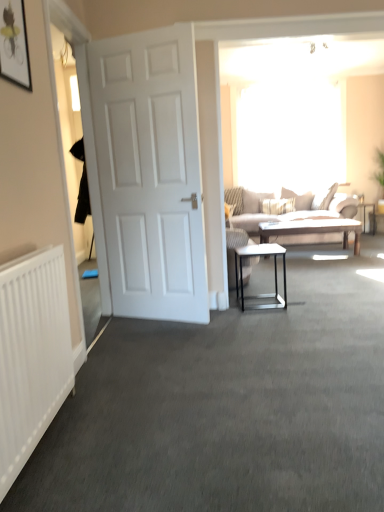
Question: Can you confirm if white matte door at left is taller than metallic silver side table at right?

Choices:
 (A) yes
 (B) no

Answer: (A)

Question: Is white matte door at left placed right next to metallic silver side table at right?

Choices:
 (A) no
 (B) yes

Answer: (A)

Question: Does white matte door at left appear on the left side of metallic silver side table at right?

Choices:
 (A) yes
 (B) no

Answer: (A)

Question: Can you confirm if white matte door at left is smaller than metallic silver side table at right?

Choices:
 (A) no
 (B) yes

Answer: (A)

Question: Can you confirm if white matte door at left is shorter than metallic silver side table at right?

Choices:
 (A) yes
 (B) no

Answer: (B)

Question: Considering the positions of white matte door at left and transparent glass window at upper center in the image, is white matte door at left wider or thinner than transparent glass window at upper center?

Choices:
 (A) thin
 (B) wide

Answer: (B)

Question: Would you say white matte door at left is inside or outside transparent glass window at upper center?

Choices:
 (A) inside
 (B) outside

Answer: (B)

Question: Is white matte door at left taller or shorter than transparent glass window at upper center?

Choices:
 (A) short
 (B) tall

Answer: (B)

Question: Considering their positions, is white matte door at left located in front of or behind transparent glass window at upper center?

Choices:
 (A) front
 (B) behind

Answer: (A)

Question: From a real-world perspective, relative to white matte door at left, is matte black picture frame at upper left vertically above or below?

Choices:
 (A) above
 (B) below

Answer: (A)

Question: Is point 23,31 closer or farther from the camera than point 144,109?

Choices:
 (A) farther
 (B) closer

Answer: (B)

Question: From the image's perspective, is matte black picture frame at upper left above or below white matte door at left?

Choices:
 (A) above
 (B) below

Answer: (A)

Question: Considering the positions of matte black picture frame at upper left and white matte door at left in the image, is matte black picture frame at upper left taller or shorter than white matte door at left?

Choices:
 (A) short
 (B) tall

Answer: (A)

Question: From the image's perspective, is white glossy side table at center located above or below white textured radiator at left?

Choices:
 (A) above
 (B) below

Answer: (A)

Question: From a real-world perspective, is white glossy side table at center above or below white textured radiator at left?

Choices:
 (A) above
 (B) below

Answer: (B)